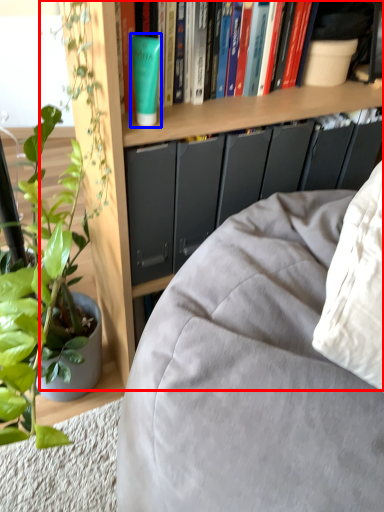
Question: Which of the following is the farthest to the observer, bookcase (highlighted by a red box) or paperback book (highlighted by a blue box)?

Choices:
 (A) bookcase
 (B) paperback book

Answer: (B)